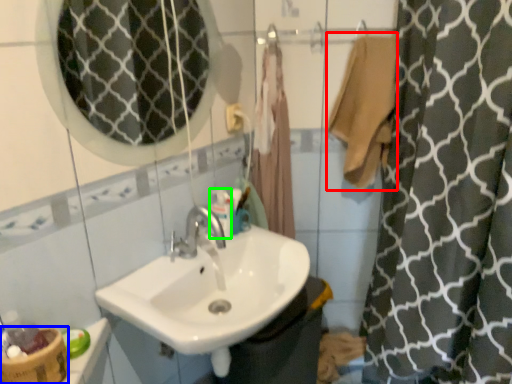
Question: Which object is the closest to the bath towel (highlighted by a red box)? Choose among these: basket (highlighted by a blue box) or mouthwash (highlighted by a green box).

Choices:
 (A) basket
 (B) mouthwash

Answer: (B)